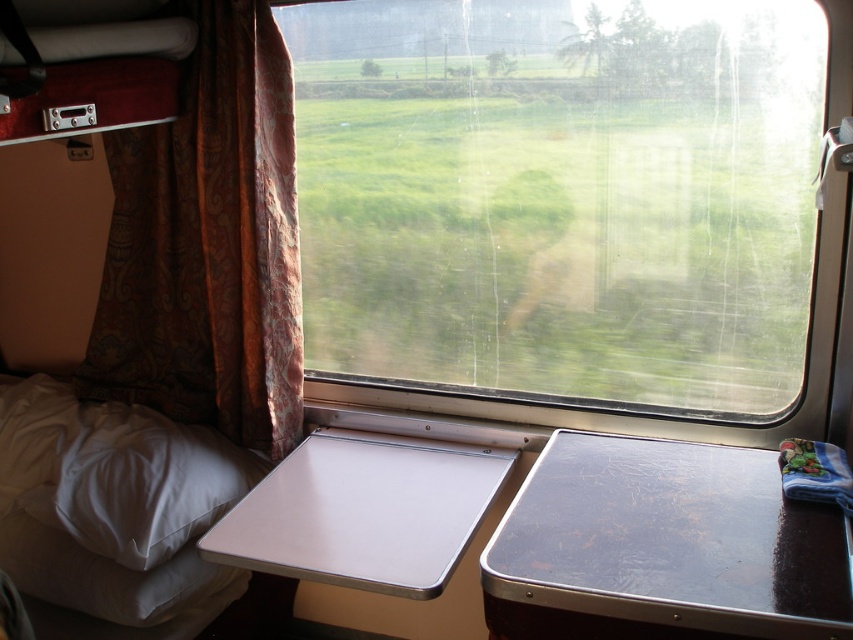
Question: Which object is closer to the camera taking this photo?

Choices:
 (A) brown patterned curtain at left
 (B) white soft pillow at lower left
 (C) shiny brown table at right
 (D) white soft bed at lower left

Answer: (C)

Question: Which is farther from the white soft bed at lower left?

Choices:
 (A) shiny brown table at right
 (B) white soft pillow at lower left
 (C) transparent glass window at center

Answer: (A)

Question: Is transparent glass window at center wider than shiny brown table at right?

Choices:
 (A) yes
 (B) no

Answer: (A)

Question: Does transparent glass window at center appear over white soft pillow at lower left?

Choices:
 (A) yes
 (B) no

Answer: (A)

Question: Can you confirm if transparent glass window at center is positioned above shiny brown table at right?

Choices:
 (A) no
 (B) yes

Answer: (B)

Question: Which object appears closest to the camera in this image?

Choices:
 (A) transparent glass window at center
 (B) brown patterned curtain at left

Answer: (A)